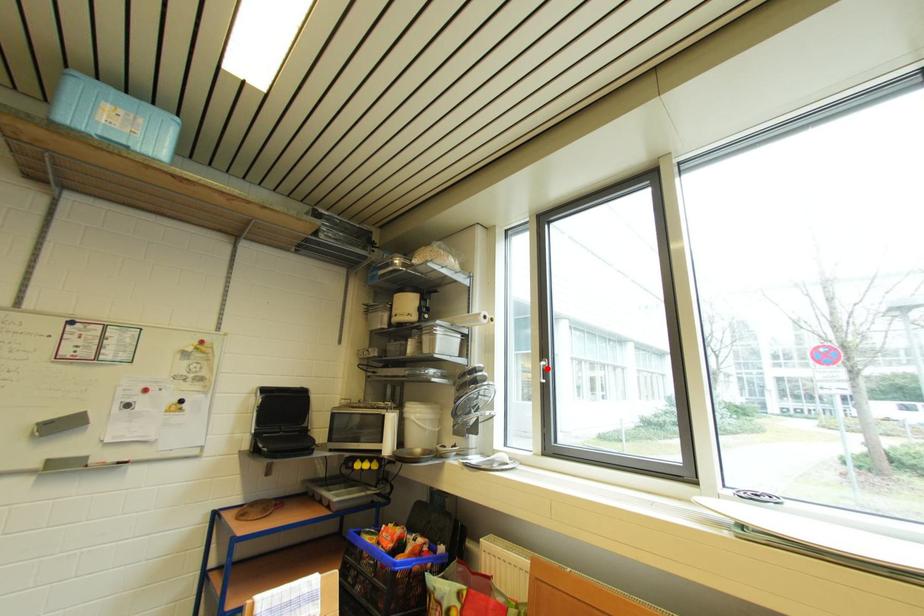
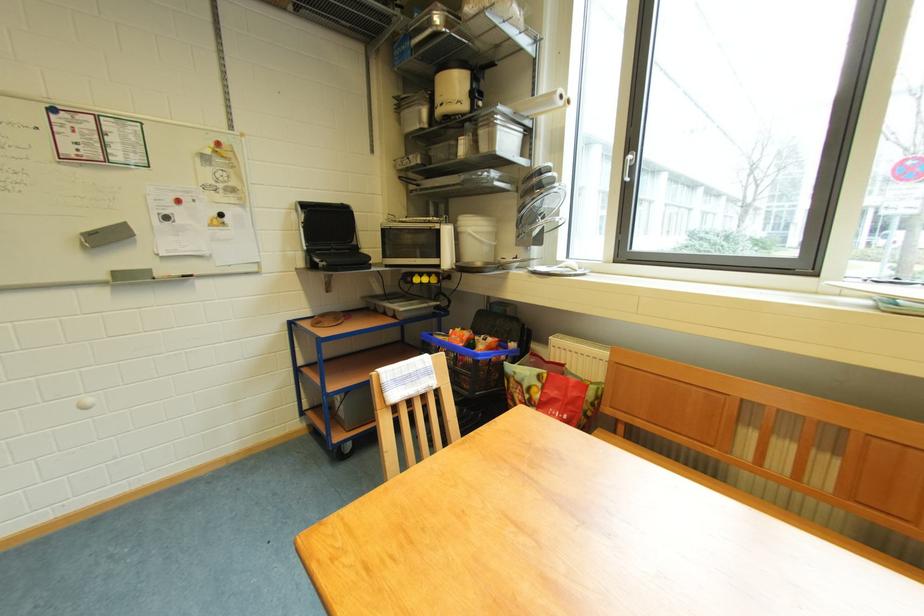
The point at the highlighted location is marked in the first image. Where is the corresponding point in the second image?

(634, 161)